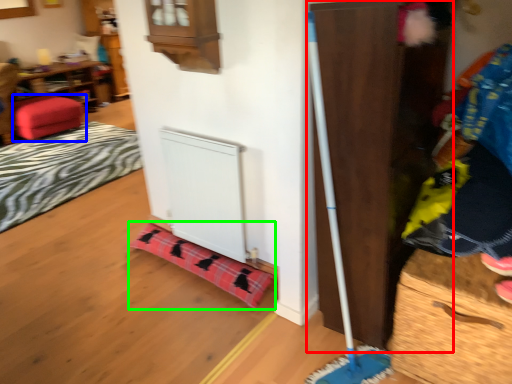
Question: Based on their relative distances, which object is farther from dresser (highlighted by a red box)? Choose from furniture (highlighted by a blue box) and blanket (highlighted by a green box).

Choices:
 (A) furniture
 (B) blanket

Answer: (A)